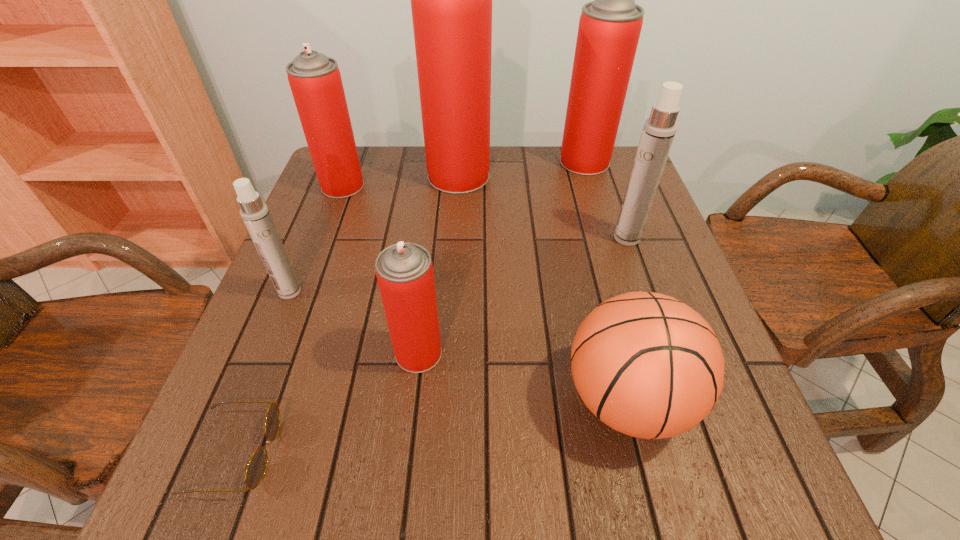
I want to click on free space located 0.370m on the left of the basketball, so click(x=345, y=399).

Where is `free location located on the lenses of the sunglasses`? free location located on the lenses of the sunglasses is located at coordinates (532, 452).

Where is `basketball at the near edge`? The height and width of the screenshot is (540, 960). basketball at the near edge is located at coordinates (647, 365).

At what (x,y) coordinates should I click in order to perform the action: click on sunglasses that is at the near edge. Please return your answer as a coordinate pair (x, y). The image size is (960, 540). Looking at the image, I should click on (256, 469).

This screenshot has width=960, height=540. I want to click on sunglasses that is at the left edge, so click(256, 469).

In order to click on basketball that is at the right edge in this screenshot , I will do `click(647, 365)`.

Where is `object at the far left corner`? The height and width of the screenshot is (540, 960). object at the far left corner is located at coordinates (315, 80).

You are a GUI agent. You are given a task and a screenshot of the screen. Output one action in this format:
    pyautogui.click(x=<x>, y=<y>)
    Task: Click on the object situated at the near left corner
    The height and width of the screenshot is (540, 960).
    Given the screenshot: What is the action you would take?
    pyautogui.click(x=256, y=469)

Where is `object at the far right corner`? object at the far right corner is located at coordinates (609, 28).

At what (x,y) coordinates should I click in order to perform the action: click on object situated at the near right corner. Please return your answer as a coordinate pair (x, y). This screenshot has width=960, height=540. Looking at the image, I should click on (647, 365).